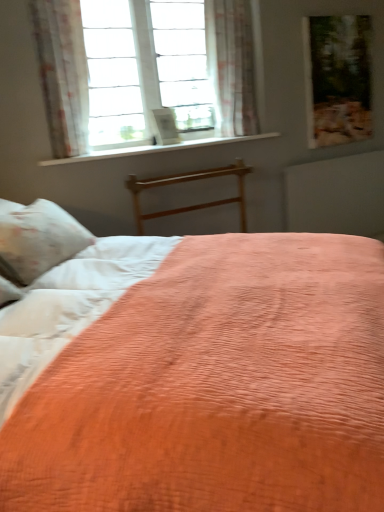
Question: Are wooden picture frame at upper right and coral quilted bed at center located far from each other?

Choices:
 (A) no
 (B) yes

Answer: (A)

Question: Considering the relative sizes of wooden picture frame at upper right and coral quilted bed at center in the image provided, is wooden picture frame at upper right smaller than coral quilted bed at center?

Choices:
 (A) yes
 (B) no

Answer: (A)

Question: From the image's perspective, is wooden picture frame at upper right located above coral quilted bed at center?

Choices:
 (A) yes
 (B) no

Answer: (A)

Question: Is wooden picture frame at upper right wider than coral quilted bed at center?

Choices:
 (A) no
 (B) yes

Answer: (A)

Question: Does wooden picture frame at upper right touch coral quilted bed at center?

Choices:
 (A) yes
 (B) no

Answer: (B)

Question: Visually, is white smooth window sill at upper center positioned to the left or to the right of wooden bed frame at center?

Choices:
 (A) right
 (B) left

Answer: (B)

Question: Is point (233, 140) positioned closer to the camera than point (135, 189)?

Choices:
 (A) farther
 (B) closer

Answer: (A)

Question: In the image, is white smooth window sill at upper center positioned in front of or behind wooden bed frame at center?

Choices:
 (A) front
 (B) behind

Answer: (B)

Question: From a real-world perspective, is white smooth window sill at upper center positioned above or below wooden bed frame at center?

Choices:
 (A) below
 (B) above

Answer: (B)

Question: Visually, is white smooth window sill at upper center positioned to the left or to the right of matte wood radiator at upper right?

Choices:
 (A) right
 (B) left

Answer: (B)

Question: From a real-world perspective, is white smooth window sill at upper center above or below matte wood radiator at upper right?

Choices:
 (A) above
 (B) below

Answer: (A)

Question: Is white smooth window sill at upper center situated inside matte wood radiator at upper right or outside?

Choices:
 (A) inside
 (B) outside

Answer: (B)

Question: Is white smooth window sill at upper center bigger or smaller than matte wood radiator at upper right?

Choices:
 (A) big
 (B) small

Answer: (B)

Question: From a real-world perspective, is wooden picture frame at upper right above or below matte wood radiator at upper right?

Choices:
 (A) below
 (B) above

Answer: (B)

Question: Does point (365, 114) appear closer or farther from the camera than point (344, 202)?

Choices:
 (A) farther
 (B) closer

Answer: (B)